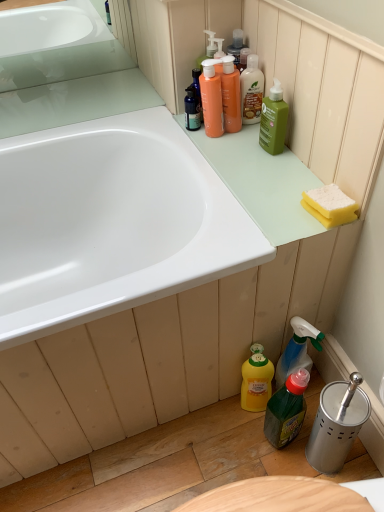
Find the location of a particular element. Image resolution: width=384 pixels, height=512 pixels. vacant space situated on the left part of green matte bottle at upper right, which appears as the 3th cleaning product when viewed from the top is located at coordinates (219, 150).